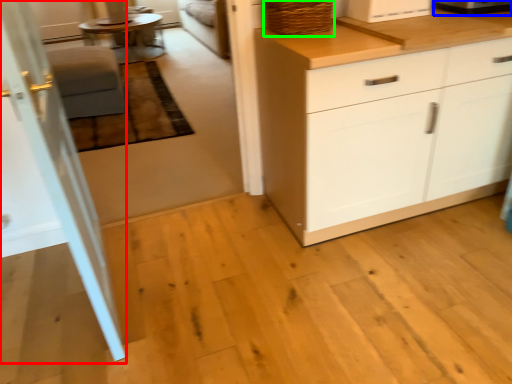
Question: Which object is the farthest from screen door (highlighted by a red box)? Choose among these: appliance (highlighted by a blue box) or basket (highlighted by a green box).

Choices:
 (A) appliance
 (B) basket

Answer: (A)